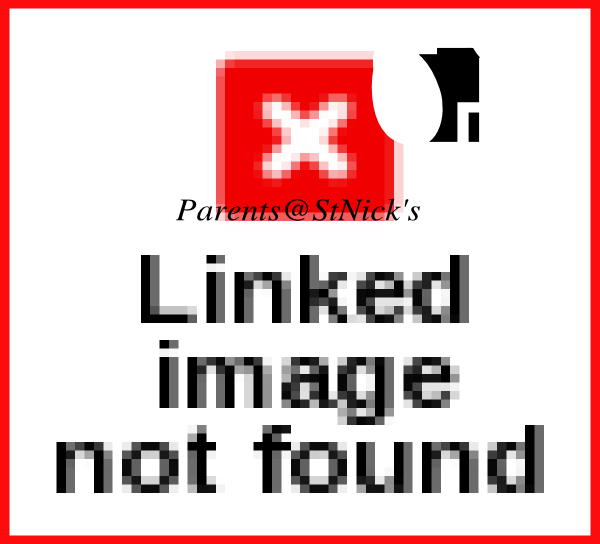
The height and width of the screenshot is (544, 600). I want to click on box, so click(x=237, y=178).